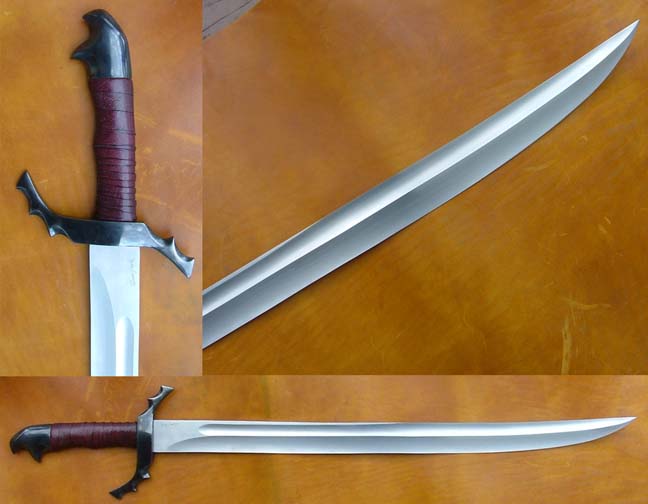
At what (x,y) coordinates should I click in order to perform the action: click on surface. Please return your answer as a coordinate pair (x, y). Looking at the image, I should click on (422, 356).